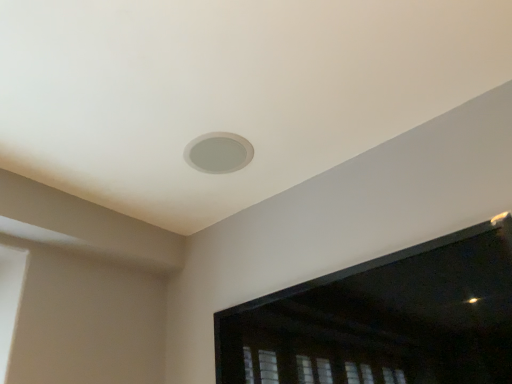
Question: Which is correct: white matte hole at center is inside transparent plastic window screen at upper center, or outside of it?

Choices:
 (A) outside
 (B) inside

Answer: (A)

Question: In terms of size, does white matte hole at center appear bigger or smaller than transparent plastic window screen at upper center?

Choices:
 (A) small
 (B) big

Answer: (A)

Question: Is white matte hole at center taller or shorter than transparent plastic window screen at upper center?

Choices:
 (A) short
 (B) tall

Answer: (A)

Question: In the image, is transparent plastic window screen at upper center on the left side or the right side of white matte hole at center?

Choices:
 (A) right
 (B) left

Answer: (A)

Question: Considering the positions of transparent plastic window screen at upper center and white matte hole at center in the image, is transparent plastic window screen at upper center taller or shorter than white matte hole at center?

Choices:
 (A) short
 (B) tall

Answer: (B)

Question: From a real-world perspective, is transparent plastic window screen at upper center physically located above or below white matte hole at center?

Choices:
 (A) above
 (B) below

Answer: (B)

Question: Is transparent plastic window screen at upper center in front of or behind white matte hole at center in the image?

Choices:
 (A) behind
 (B) front

Answer: (B)